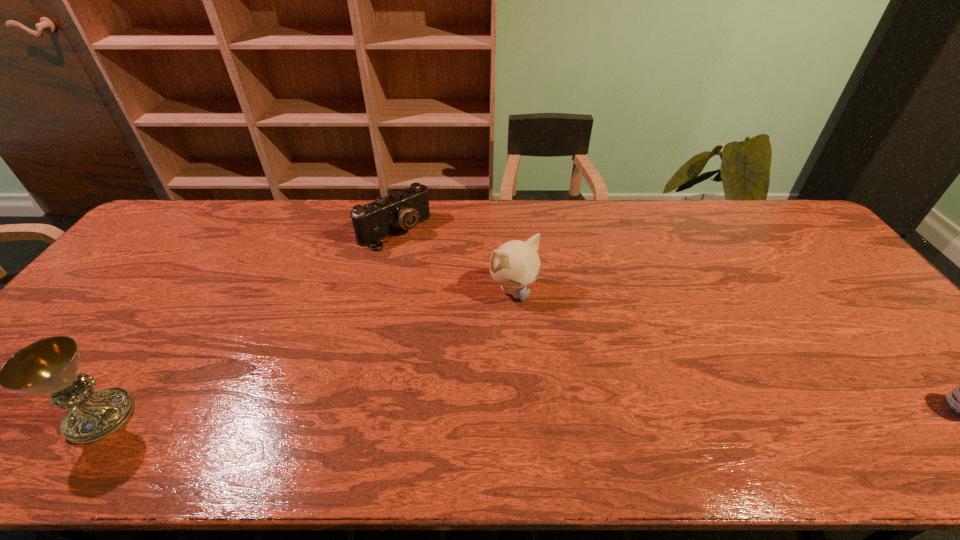
At what (x,y) coordinates should I click in order to perform the action: click on free spot on the desktop that is between the leftmost object and the rightmost object and is positioned on the face of the kitten. Please return your answer as a coordinate pair (x, y). The image size is (960, 540). Looking at the image, I should click on (626, 411).

This screenshot has height=540, width=960. I want to click on vacant spot on the desktop that is between the chalice and the rightmost object and is positioned on the front-facing side of the farthest object, so click(x=591, y=411).